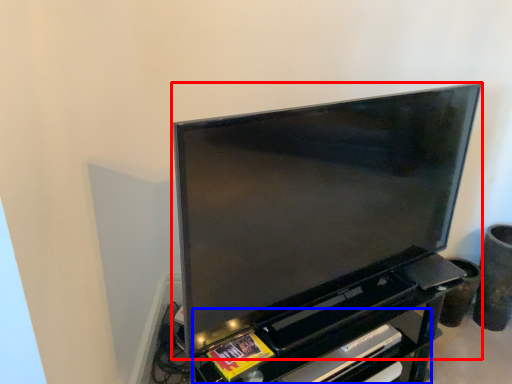
Question: Which point is further to the camera, television (highlighted by a red box) or shelf (highlighted by a blue box)?

Choices:
 (A) television
 (B) shelf

Answer: (B)